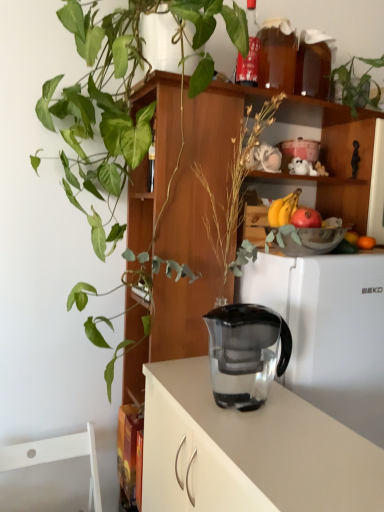
Where is `vacant area located to the right-hand side of transparent plastic jug at center`? Image resolution: width=384 pixels, height=512 pixels. vacant area located to the right-hand side of transparent plastic jug at center is located at coordinates (311, 417).